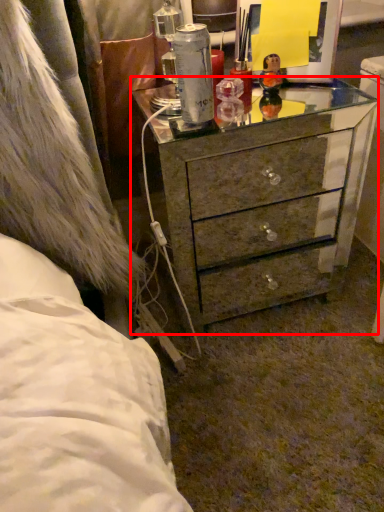
Question: From the image's perspective, what is the correct spatial relationship of chest of drawers (annotated by the red box) in relation to toy?

Choices:
 (A) above
 (B) below

Answer: (B)